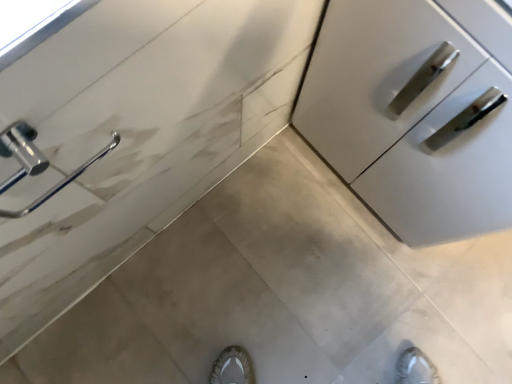
Question: Is chrome/metallic door handle at left taller or shorter than satin white cabinet at right?

Choices:
 (A) tall
 (B) short

Answer: (B)

Question: From the image's perspective, is chrome/metallic door handle at left positioned above or below satin white cabinet at right?

Choices:
 (A) above
 (B) below

Answer: (B)

Question: Would you say chrome/metallic door handle at left is to the left or to the right of satin white cabinet at right in the picture?

Choices:
 (A) left
 (B) right

Answer: (A)

Question: Looking at their shapes, would you say satin white cabinet at right is wider or thinner than chrome/metallic door handle at left?

Choices:
 (A) thin
 (B) wide

Answer: (B)

Question: From the image's perspective, is satin white cabinet at right positioned above or below chrome/metallic door handle at left?

Choices:
 (A) below
 (B) above

Answer: (B)

Question: Considering the relative positions of satin white cabinet at right and chrome/metallic door handle at left in the image provided, is satin white cabinet at right to the left or to the right of chrome/metallic door handle at left?

Choices:
 (A) right
 (B) left

Answer: (A)

Question: Relative to chrome/metallic door handle at left, is satin white cabinet at right in front or behind?

Choices:
 (A) front
 (B) behind

Answer: (B)